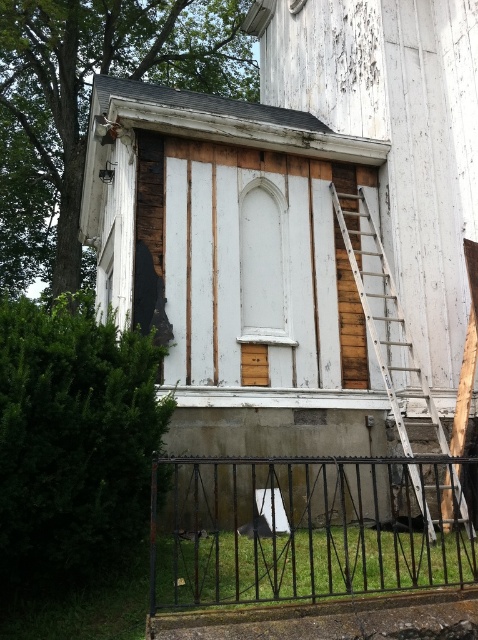
Looking at this image, you are a painter standing at the base of the wooden ladder at right, and you need to reach the black wrought iron fence at lower center to paint it. Can you easily walk from the ladder to the fence without moving any objects?

The black wrought iron fence at lower center is 1.21 meters away from the wooden ladder at right, so yes, you can easily walk from the ladder to the fence without moving any objects since the distance is manageable.

You are standing at the entrance of the building and want to reach the ladder leaning against the building. Which direction should you move relative to the black wrought iron fence at lower center to get there?

To reach the ladder leaning against the building from the entrance, you should move away from the black wrought iron fence at lower center since the ladder is positioned opposite to it.